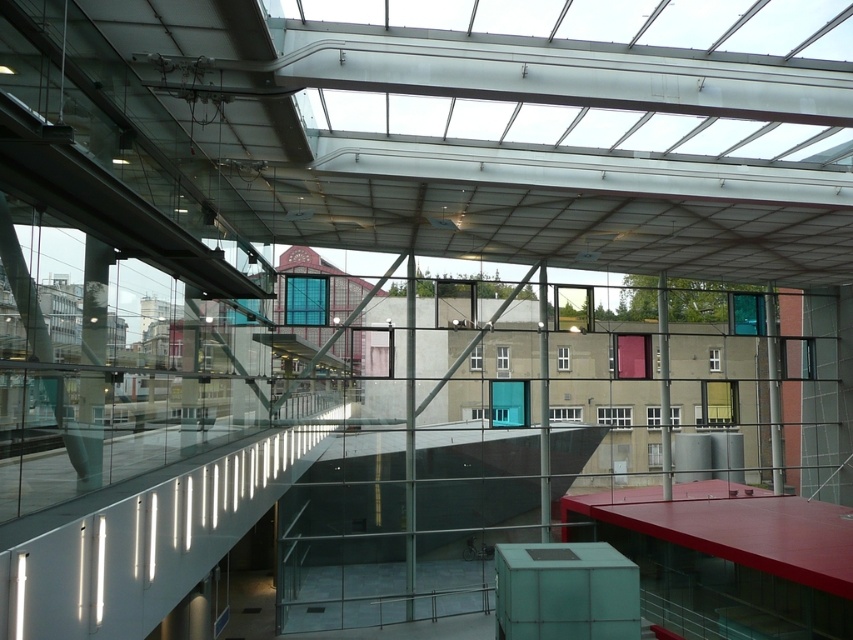
You are an architect designing a new exhibit space in this atrium. You need to place a 20 feet wide sculpture between the matte glass pillar at left and the matte glass pillar at center. Is there enough space between them to accommodate the sculpture?

The distance between the matte glass pillar at left and the matte glass pillar at center is 65.34 feet. Since the sculpture is only 20 feet wide, there is ample space to place it between them.

You are an architect designing a new exhibition space in the atrium. You need to place a large sculpture that requires a clear vertical space of 3 meters. Given the positions of the matte glass pillar at left and the matte glass pillar at center, can you determine if there is enough vertical space between them to accommodate the sculpture?

The matte glass pillar at left is located above the matte glass pillar at center. Since the vertical distance between them must be at least 3 meters to fit the sculpture, but the description only states their relative positions without specifying the exact distance, it is unclear if there is sufficient space. Further measurements would be needed to confirm.

You are standing in the atrium and want to move from the left side to the right side. There are two matte glass pillars in your path. Which direction should you go around the matte glass pillar at left and matte glass pillar at center to avoid them?

To avoid the matte glass pillar at left and matte glass pillar at center, you should go around to the right side of both pillars since the matte glass pillar at left is to the left of matte glass pillar at center, meaning they are aligned horizontally. Going right of each would keep you moving towards the right side.